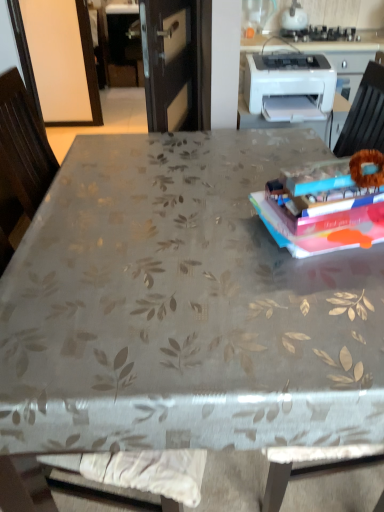
Question: From a real-world perspective, is white glossy kettle at upper center physically located above or below hardcover book at upper right?

Choices:
 (A) above
 (B) below

Answer: (A)

Question: Based on their sizes in the image, would you say white glossy kettle at upper center is bigger or smaller than hardcover book at upper right?

Choices:
 (A) small
 (B) big

Answer: (B)

Question: Which of these objects is positioned farthest from the hardcover book at upper right?

Choices:
 (A) white glossy countertop at upper center
 (B) white plastic printer at upper right
 (C) white glossy kettle at upper center

Answer: (C)

Question: Estimate the real-world distances between objects in this image. Which object is closer to the hardcover book at upper right?

Choices:
 (A) white plastic printer at upper right
 (B) white glossy countertop at upper center
 (C) white glossy kettle at upper center

Answer: (A)